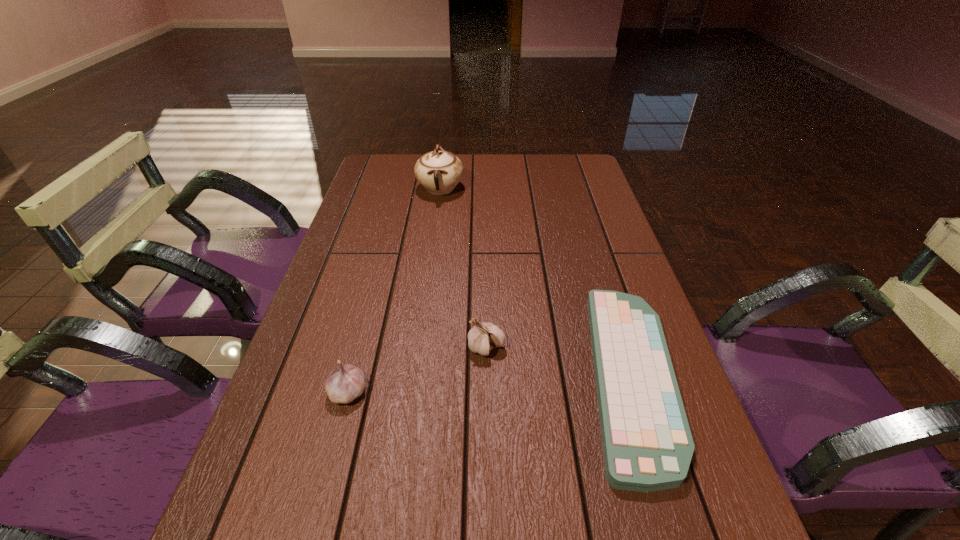
Identify which object is the third closest to the leftmost object. Please provide its 2D coordinates. Your answer should be formatted as a tuple, i.e. [(x, y)], where the tuple contains the x and y coordinates of a point satisfying the conditions above.

[(439, 171)]

At what (x,y) coordinates should I click in order to perform the action: click on vacant space that satisfies the following two spatial constraints: 1. on the back side of the leftmost object; 2. on the left side of the rightmost object. Please return your answer as a coordinate pair (x, y). Looking at the image, I should click on click(352, 376).

The image size is (960, 540). In order to click on blank space that satisfies the following two spatial constraints: 1. on the back side of the nearer garlic; 2. on the left side of the shortest object in this screenshot , I will do `click(352, 376)`.

Locate an element on the screen. The width and height of the screenshot is (960, 540). vacant space that satisfies the following two spatial constraints: 1. on the front side of the third object from right to left; 2. on the left side of the shortest object is located at coordinates (415, 376).